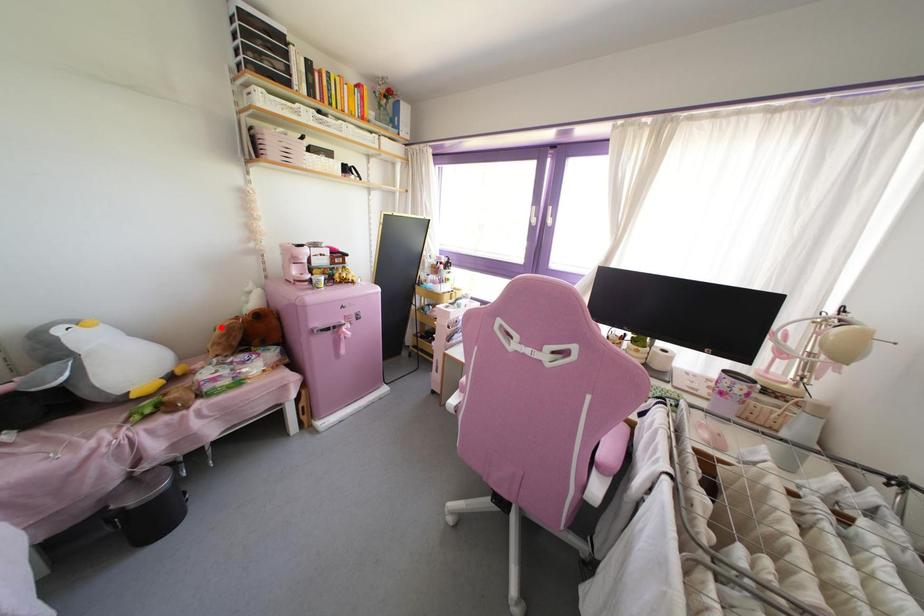
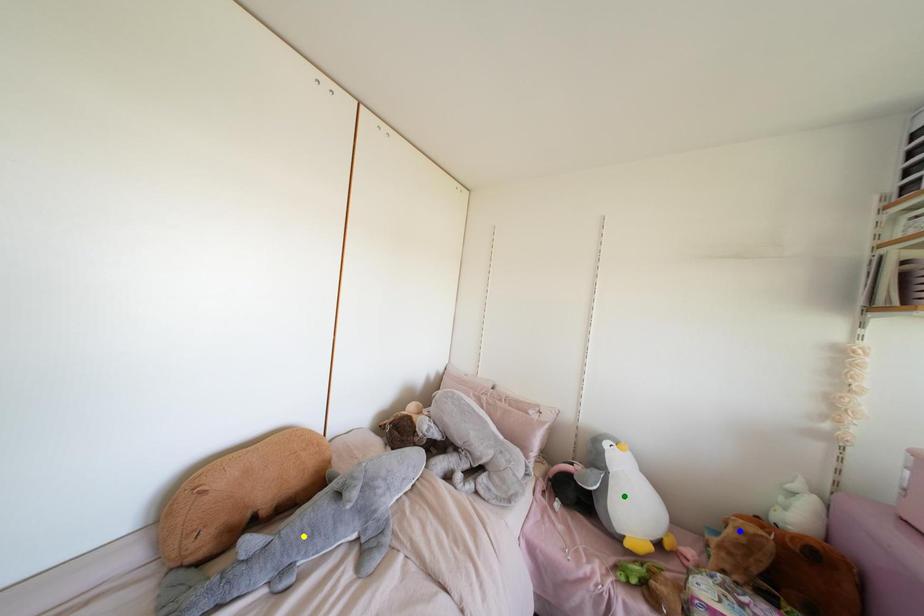
Question: I am providing you with two images of the same scene from different viewpoints. A red point is marked on the first image. You are given multiple points on the second image. In image 2, which mark is for the same physical point as the one in image 1?

Choices:
 (A) green point
 (B) blue point
 (C) yellow point

Answer: (B)